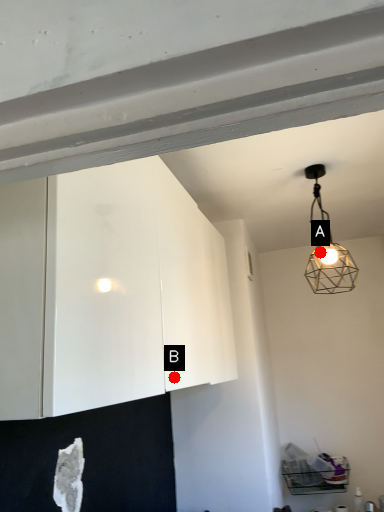
Question: Two points are circled on the image, labeled by A and B beside each circle. Which point is further to the camera?

Choices:
 (A) A is further
 (B) B is further

Answer: (A)